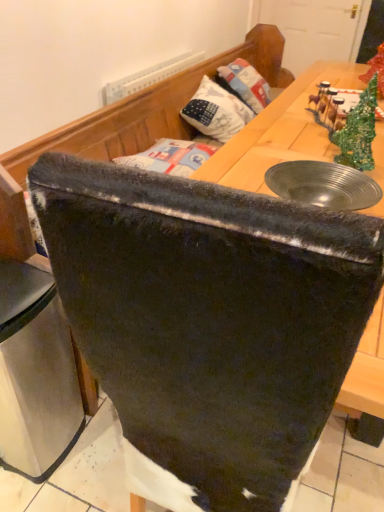
Question: Does stainless steel trash can at lower left have a lesser height compared to velvet black chair at center?

Choices:
 (A) yes
 (B) no

Answer: (A)

Question: Is stainless steel trash can at lower left aimed at velvet black chair at center?

Choices:
 (A) yes
 (B) no

Answer: (B)

Question: From the image's perspective, is stainless steel trash can at lower left on velvet black chair at center?

Choices:
 (A) no
 (B) yes

Answer: (A)

Question: From the image's perspective, is stainless steel trash can at lower left below velvet black chair at center?

Choices:
 (A) no
 (B) yes

Answer: (B)

Question: Is stainless steel trash can at lower left turned away from velvet black chair at center?

Choices:
 (A) yes
 (B) no

Answer: (A)

Question: Would you say stainless steel trash can at lower left is outside velvet black chair at center?

Choices:
 (A) no
 (B) yes

Answer: (B)

Question: Is white fabric pillow at upper center in front of stainless steel trash can at lower left?

Choices:
 (A) no
 (B) yes

Answer: (A)

Question: Considering the relative positions of white fabric pillow at upper center and stainless steel trash can at lower left in the image provided, is white fabric pillow at upper center to the right of stainless steel trash can at lower left from the viewer's perspective?

Choices:
 (A) no
 (B) yes

Answer: (B)

Question: Considering the relative sizes of white fabric pillow at upper center and stainless steel trash can at lower left in the image provided, is white fabric pillow at upper center wider than stainless steel trash can at lower left?

Choices:
 (A) no
 (B) yes

Answer: (B)

Question: Is white fabric pillow at upper center further to camera compared to stainless steel trash can at lower left?

Choices:
 (A) yes
 (B) no

Answer: (A)

Question: Is white fabric pillow at upper center bigger than stainless steel trash can at lower left?

Choices:
 (A) yes
 (B) no

Answer: (B)

Question: Is white fabric pillow at upper center oriented towards stainless steel trash can at lower left?

Choices:
 (A) yes
 (B) no

Answer: (B)

Question: From the image's perspective, is velvet black chair at center located beneath stainless steel trash can at lower left?

Choices:
 (A) yes
 (B) no

Answer: (B)